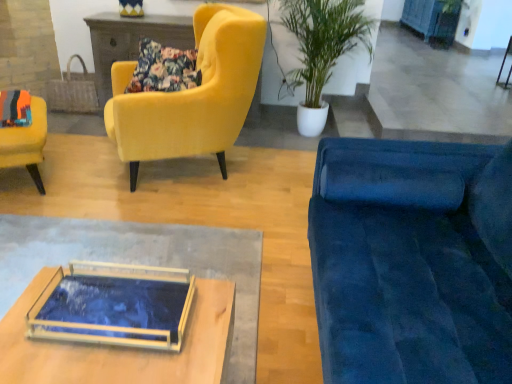
I want to click on free space in front of yellow and blue striped vase at upper center, so click(x=125, y=21).